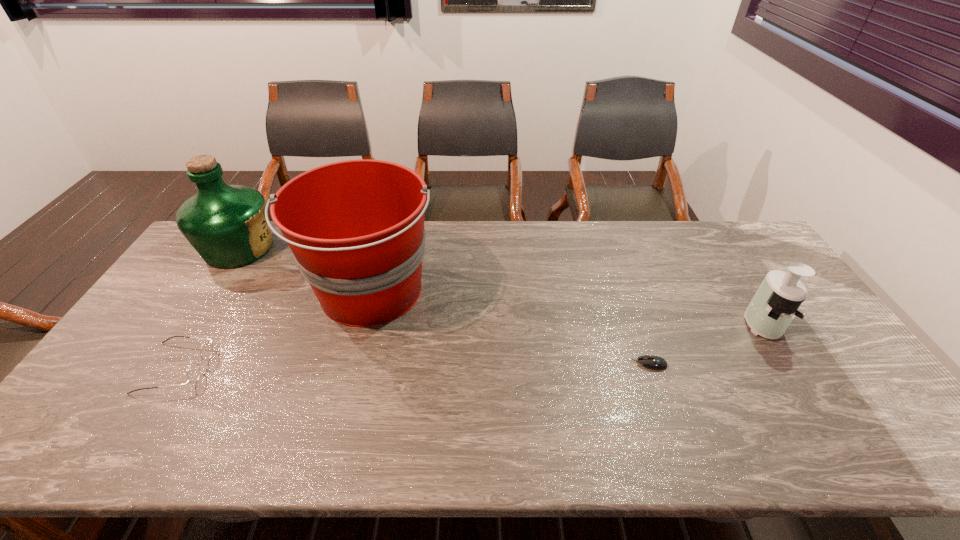
What are the coordinates of `the third object from left to right` in the screenshot? It's located at (356, 230).

Locate an element on the screen. This screenshot has height=540, width=960. liquor is located at coordinates (226, 224).

Image resolution: width=960 pixels, height=540 pixels. In order to click on the third shortest object in this screenshot , I will do `click(775, 304)`.

At what (x,y) coordinates should I click in order to perform the action: click on the rightmost object. Please return your answer as a coordinate pair (x, y). Looking at the image, I should click on (775, 304).

I want to click on spectacles, so click(x=193, y=373).

In order to click on computer mouse in this screenshot , I will do `click(653, 362)`.

This screenshot has height=540, width=960. In order to click on the second object from right to left in this screenshot , I will do (653, 362).

At what (x,y) coordinates should I click in order to perform the action: click on vacant space situated 0.290m on the right of the third object from right to left. Please return your answer as a coordinate pair (x, y). The width and height of the screenshot is (960, 540). Looking at the image, I should click on (532, 292).

This screenshot has width=960, height=540. In order to click on free space located on the label side of the liquor in this screenshot , I will do `click(296, 248)`.

Find the location of a particular element. Image resolution: width=960 pixels, height=540 pixels. free space located on the back of the juicer is located at coordinates (703, 231).